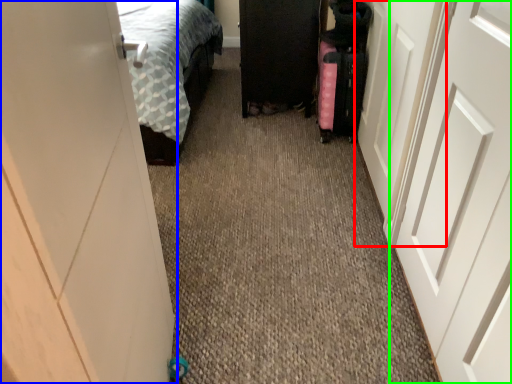
Question: Which is nearer to the door (highlighted by a red box)? door (highlighted by a blue box) or door (highlighted by a green box).

Choices:
 (A) door
 (B) door

Answer: (B)